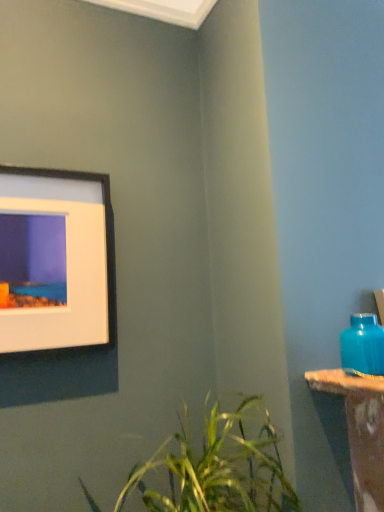
Question: Is black matte picture frame at upper left located within matte blue vase at right?

Choices:
 (A) no
 (B) yes

Answer: (A)

Question: Does matte blue vase at right have a lesser height compared to black matte picture frame at upper left?

Choices:
 (A) yes
 (B) no

Answer: (A)

Question: From a real-world perspective, is matte blue vase at right below black matte picture frame at upper left?

Choices:
 (A) no
 (B) yes

Answer: (B)

Question: From the image's perspective, is matte blue vase at right beneath black matte picture frame at upper left?

Choices:
 (A) no
 (B) yes

Answer: (B)

Question: Does matte blue vase at right turn towards black matte picture frame at upper left?

Choices:
 (A) yes
 (B) no

Answer: (B)

Question: Is matte blue vase at right thinner than black matte picture frame at upper left?

Choices:
 (A) no
 (B) yes

Answer: (A)

Question: Is black matte picture frame at upper left completely or partially outside of matte blue vase at right?

Choices:
 (A) yes
 (B) no

Answer: (A)

Question: From the image's perspective, is black matte picture frame at upper left under matte blue vase at right?

Choices:
 (A) no
 (B) yes

Answer: (A)

Question: Can you confirm if black matte picture frame at upper left is bigger than matte blue vase at right?

Choices:
 (A) yes
 (B) no

Answer: (A)

Question: Can you confirm if black matte picture frame at upper left is taller than matte blue vase at right?

Choices:
 (A) yes
 (B) no

Answer: (A)

Question: Considering the relative positions of black matte picture frame at upper left and matte blue vase at right in the image provided, is black matte picture frame at upper left in front of matte blue vase at right?

Choices:
 (A) yes
 (B) no

Answer: (B)

Question: From a real-world perspective, does black matte picture frame at upper left sit lower than matte blue vase at right?

Choices:
 (A) yes
 (B) no

Answer: (B)

Question: Is matte blue vase at right spatially inside black matte picture frame at upper left, or outside of it?

Choices:
 (A) outside
 (B) inside

Answer: (A)